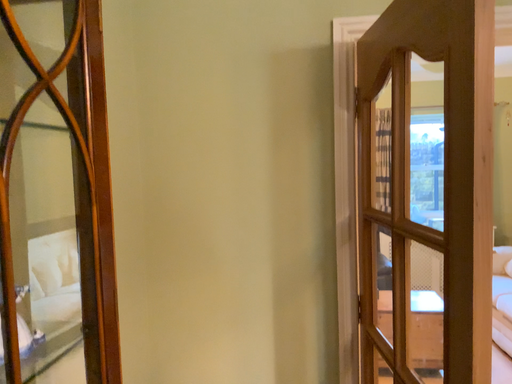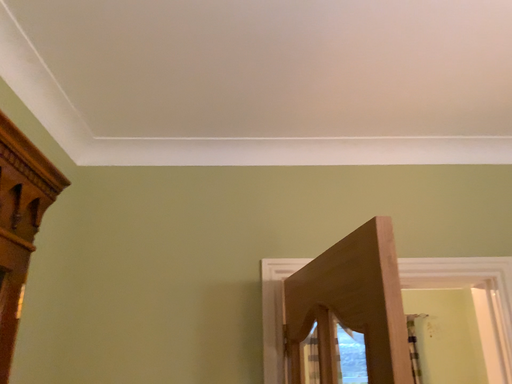
Question: How did the camera likely rotate when shooting the video?

Choices:
 (A) rotated left
 (B) rotated right

Answer: (B)